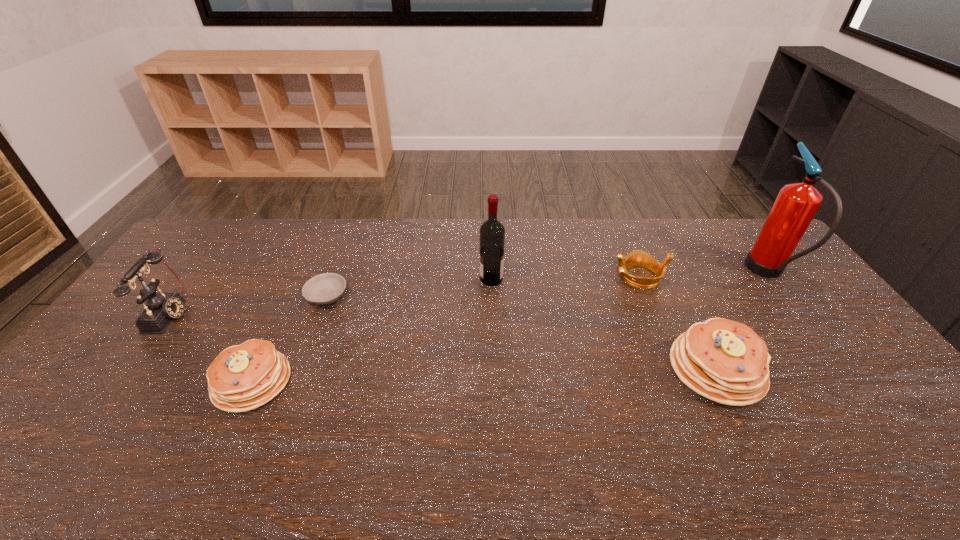
Image resolution: width=960 pixels, height=540 pixels. I want to click on vacant space situated 0.240m on the front and back of the alcohol, so click(x=408, y=279).

At what (x,y) coordinates should I click in order to perform the action: click on vacant space located 0.210m on the front and back of the alcohol. Please return your answer as a coordinate pair (x, y). Looking at the image, I should click on (418, 279).

The width and height of the screenshot is (960, 540). In order to click on object that is at the far edge in this screenshot , I will do `click(796, 204)`.

The width and height of the screenshot is (960, 540). Identify the location of object that is at the left edge. (161, 308).

The height and width of the screenshot is (540, 960). I want to click on object positioned at the right edge, so click(796, 204).

In order to click on object present at the far right corner in this screenshot , I will do `click(796, 204)`.

In the image, there is a desktop. Where is `free region at the far edge`? This screenshot has height=540, width=960. free region at the far edge is located at coordinates (376, 233).

Find the location of `vacant space at the near edge of the desktop`. vacant space at the near edge of the desktop is located at coordinates (727, 408).

Find the location of a particular element. This screenshot has height=540, width=960. vacant space at the left edge is located at coordinates (176, 289).

The height and width of the screenshot is (540, 960). Find the location of `free spot between the left pancake and the taller pancake`. free spot between the left pancake and the taller pancake is located at coordinates point(484,375).